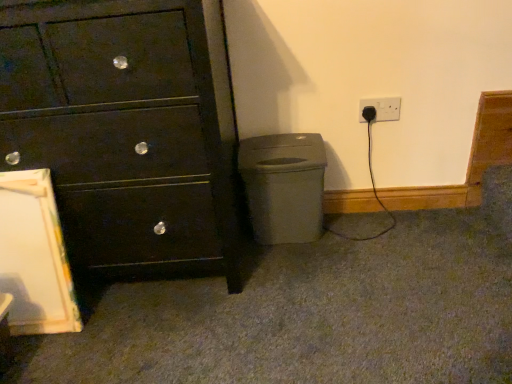
Question: Is matte gray plastic at lower right positioned far away from matte black chest of drawers at left?

Choices:
 (A) yes
 (B) no

Answer: (B)

Question: Is matte gray plastic at lower right outside matte black chest of drawers at left?

Choices:
 (A) no
 (B) yes

Answer: (B)

Question: Can you see matte gray plastic at lower right touching matte black chest of drawers at left?

Choices:
 (A) no
 (B) yes

Answer: (A)

Question: Considering the relative sizes of matte gray plastic at lower right and matte black chest of drawers at left in the image provided, is matte gray plastic at lower right shorter than matte black chest of drawers at left?

Choices:
 (A) yes
 (B) no

Answer: (A)

Question: Does matte gray plastic at lower right lie in front of matte black chest of drawers at left?

Choices:
 (A) no
 (B) yes

Answer: (A)

Question: From a real-world perspective, is matte gray plastic at lower right beneath matte black chest of drawers at left?

Choices:
 (A) yes
 (B) no

Answer: (A)

Question: Is matte black chest of drawers at left surrounded by black plastic plug at lower right?

Choices:
 (A) yes
 (B) no

Answer: (B)

Question: Can you confirm if black plastic plug at lower right is positioned to the left of matte black chest of drawers at left?

Choices:
 (A) no
 (B) yes

Answer: (A)

Question: From a real-world perspective, is black plastic plug at lower right positioned over matte black chest of drawers at left based on gravity?

Choices:
 (A) no
 (B) yes

Answer: (A)

Question: Does black plastic plug at lower right have a lesser height compared to matte black chest of drawers at left?

Choices:
 (A) yes
 (B) no

Answer: (A)

Question: Does black plastic plug at lower right lie behind matte black chest of drawers at left?

Choices:
 (A) no
 (B) yes

Answer: (B)

Question: From the image's perspective, does black plastic plug at lower right appear higher than matte black chest of drawers at left?

Choices:
 (A) yes
 (B) no

Answer: (A)

Question: Can you confirm if black plastic plug at lower right is shorter than matte gray plastic at lower right?

Choices:
 (A) yes
 (B) no

Answer: (A)